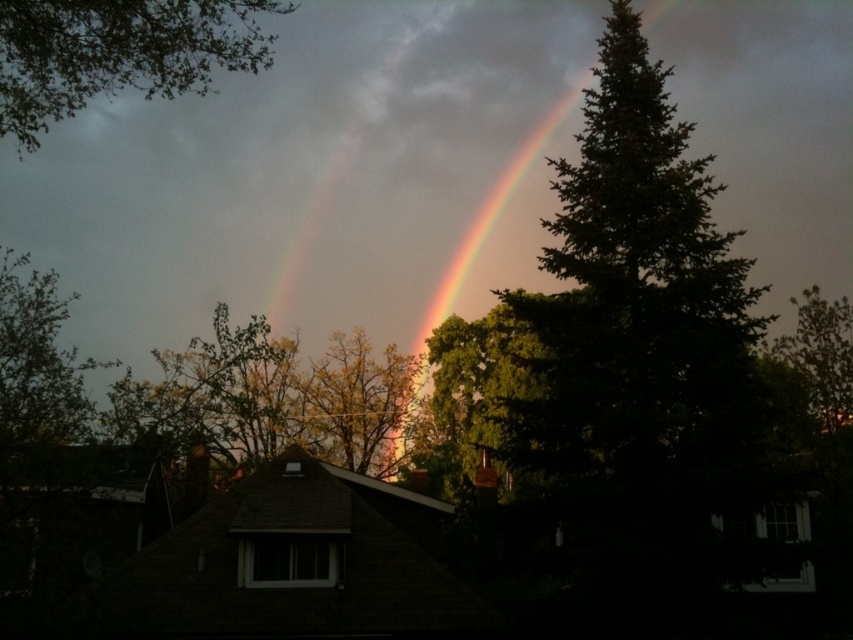
Question: Can you confirm if rainbow at center is positioned to the left of green leafy tree at right?

Choices:
 (A) yes
 (B) no

Answer: (A)

Question: Which point is farther to the camera?

Choices:
 (A) green leafy tree at right
 (B) green leafy tree at center
 (C) rainbow at center

Answer: (C)

Question: Does green leafy tree at upper left have a lesser width compared to green leafy tree at center?

Choices:
 (A) no
 (B) yes

Answer: (A)

Question: Among these points, which one is farthest from the camera?

Choices:
 (A) (831, 342)
 (B) (473, 228)
 (C) (376, 369)

Answer: (B)

Question: Does green leafy tree at center have a smaller size compared to green leafy tree at right?

Choices:
 (A) no
 (B) yes

Answer: (B)

Question: Based on their relative distances, which object is nearer to the green leafy tree at upper left?

Choices:
 (A) green leafy tree at center
 (B) green leafy tree at right

Answer: (A)